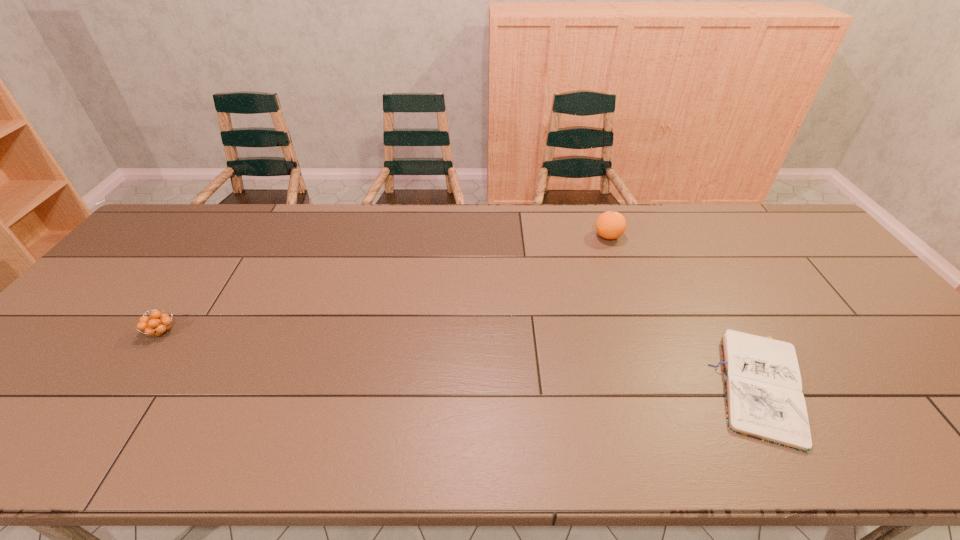
Identify the location of free spot between the nearer orange fruit and the notebook. (463, 360).

Identify the location of empty location between the notebook and the second shortest object. (463, 360).

The image size is (960, 540). I want to click on free spot between the notebook and the right orange fruit, so click(x=685, y=313).

What are the coordinates of `vacant area that lies between the notebook and the left orange fruit` in the screenshot? It's located at (463, 360).

Find the location of a particular element. This screenshot has height=540, width=960. free space between the notebook and the taller orange fruit is located at coordinates (685, 313).

At what (x,y) coordinates should I click in order to perform the action: click on object that ranks as the second closest to the shortest object. Please return your answer as a coordinate pair (x, y). Image resolution: width=960 pixels, height=540 pixels. Looking at the image, I should click on (157, 324).

Locate an element on the screen. This screenshot has height=540, width=960. object identified as the closest to the leftmost object is located at coordinates (610, 225).

Image resolution: width=960 pixels, height=540 pixels. In order to click on vacant space that satisfies the following two spatial constraints: 1. on the back side of the tallest object; 2. on the right side of the nearer orange fruit in this screenshot , I will do `click(228, 237)`.

Locate an element on the screen. free point that satisfies the following two spatial constraints: 1. on the front side of the farthest object; 2. on the right side of the notebook is located at coordinates (662, 388).

Locate an element on the screen. vacant space that satisfies the following two spatial constraints: 1. on the front side of the leftmost object; 2. on the left side of the rightmost object is located at coordinates (123, 388).